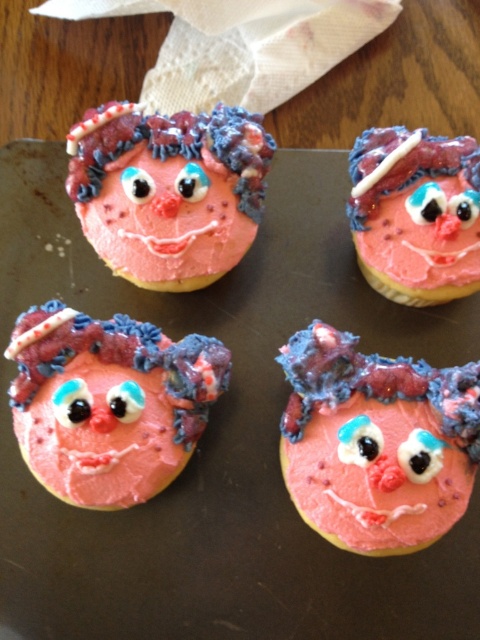
Is pink matte cookie at upper left positioned behind pink matte cookie at upper right?

Yes, it is behind pink matte cookie at upper right.

Is point (156, 192) positioned in front of point (376, 228)?

Yes, it is.

Identify the location of pink matte cookie at upper left. Image resolution: width=480 pixels, height=640 pixels. (168, 192).

Find the location of a particular element. pink matte cookie at upper left is located at coordinates (168, 192).

Is point (309, 476) less distant than point (168, 355)?

Yes, it is.

Between pink matte cookie at center and pink matte cookie at lower left, which one is positioned higher?

Positioned higher is pink matte cookie at lower left.

Is point (322, 358) closer to viewer compared to point (83, 358)?

Yes, point (322, 358) is closer to viewer.

The image size is (480, 640). I want to click on pink matte cookie at center, so click(x=375, y=442).

From the picture: Between pink matte cookie at lower left and pink matte cookie at upper right, which one has less height?

With less height is pink matte cookie at upper right.

Locate an element on the screen. The width and height of the screenshot is (480, 640). pink matte cookie at lower left is located at coordinates (108, 403).